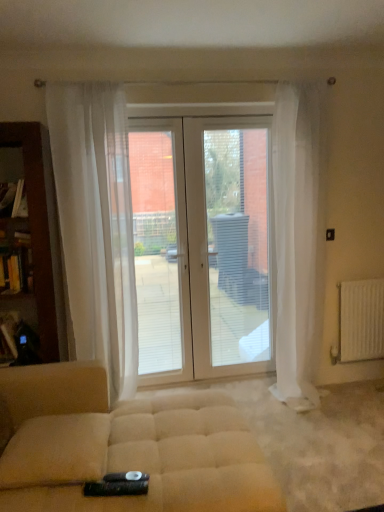
This screenshot has width=384, height=512. What are the coordinates of `empty space that is ontop of white plastic screen door at center (from a real-world perspective)` in the screenshot? It's located at pos(231,121).